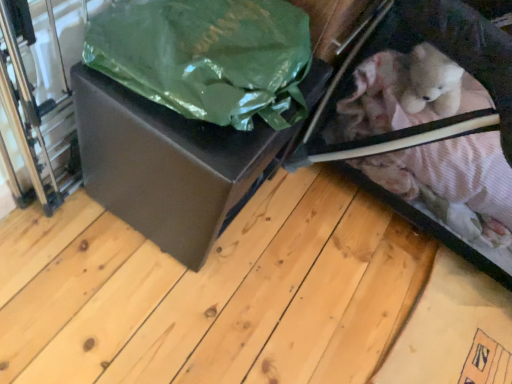
Question: Is velvet pink fabric baby carriage at lower right aimed at green matte plastic bag at upper left?

Choices:
 (A) no
 (B) yes

Answer: (A)

Question: Is velvet pink fabric baby carriage at lower right at the right side of green matte plastic bag at upper left?

Choices:
 (A) no
 (B) yes

Answer: (B)

Question: Would you say velvet pink fabric baby carriage at lower right is outside green matte plastic bag at upper left?

Choices:
 (A) yes
 (B) no

Answer: (A)

Question: Is the depth of velvet pink fabric baby carriage at lower right greater than that of green matte plastic bag at upper left?

Choices:
 (A) yes
 (B) no

Answer: (A)

Question: Is velvet pink fabric baby carriage at lower right in contact with green matte plastic bag at upper left?

Choices:
 (A) yes
 (B) no

Answer: (B)

Question: Is velvet pink fabric baby carriage at lower right smaller than green matte plastic bag at upper left?

Choices:
 (A) no
 (B) yes

Answer: (A)

Question: Is the depth of matte black box at center greater than that of green matte plastic bag at upper left?

Choices:
 (A) no
 (B) yes

Answer: (B)

Question: Can you confirm if matte black box at center is taller than green matte plastic bag at upper left?

Choices:
 (A) yes
 (B) no

Answer: (A)

Question: Is matte black box at center at the right side of green matte plastic bag at upper left?

Choices:
 (A) yes
 (B) no

Answer: (B)

Question: From the image's perspective, would you say matte black box at center is shown under green matte plastic bag at upper left?

Choices:
 (A) no
 (B) yes

Answer: (B)

Question: From a real-world perspective, is matte black box at center located higher than green matte plastic bag at upper left?

Choices:
 (A) yes
 (B) no

Answer: (B)

Question: Is matte black box at center turned away from green matte plastic bag at upper left?

Choices:
 (A) yes
 (B) no

Answer: (B)

Question: Is green matte plastic bag at upper left oriented away from velvet pink fabric baby carriage at lower right?

Choices:
 (A) no
 (B) yes

Answer: (A)